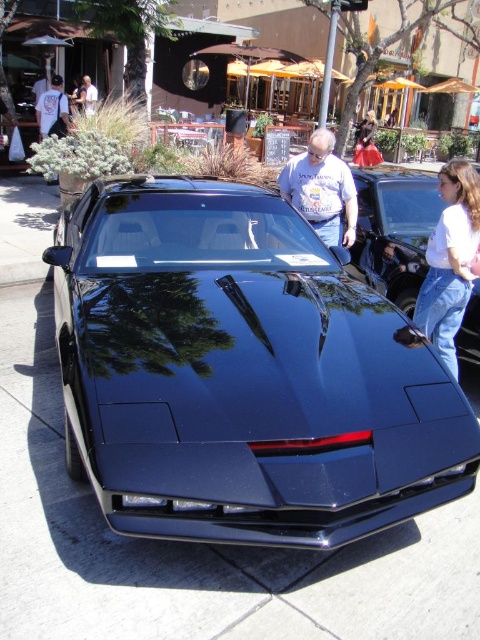
Question: Is white cotton t-shirt at center further to the viewer compared to white cotton t-shirt at upper left?

Choices:
 (A) yes
 (B) no

Answer: (B)

Question: Which of the following is the farthest from the observer?

Choices:
 (A) (84, 90)
 (B) (444, 488)
 (C) (60, 84)

Answer: (A)

Question: Among these points, which one is nearest to the camera?

Choices:
 (A) (363, 163)
 (B) (422, 314)

Answer: (B)

Question: Which point is closer to the camera?

Choices:
 (A) (372, 141)
 (B) (86, 109)
 (C) (444, 291)

Answer: (C)

Question: From the image, what is the correct spatial relationship of glossy black windshield at center in relation to white cotton t-shirt at center?

Choices:
 (A) below
 (B) above

Answer: (A)

Question: Does glossy black windshield at center have a smaller size compared to white cotton shirt at upper right?

Choices:
 (A) yes
 (B) no

Answer: (B)